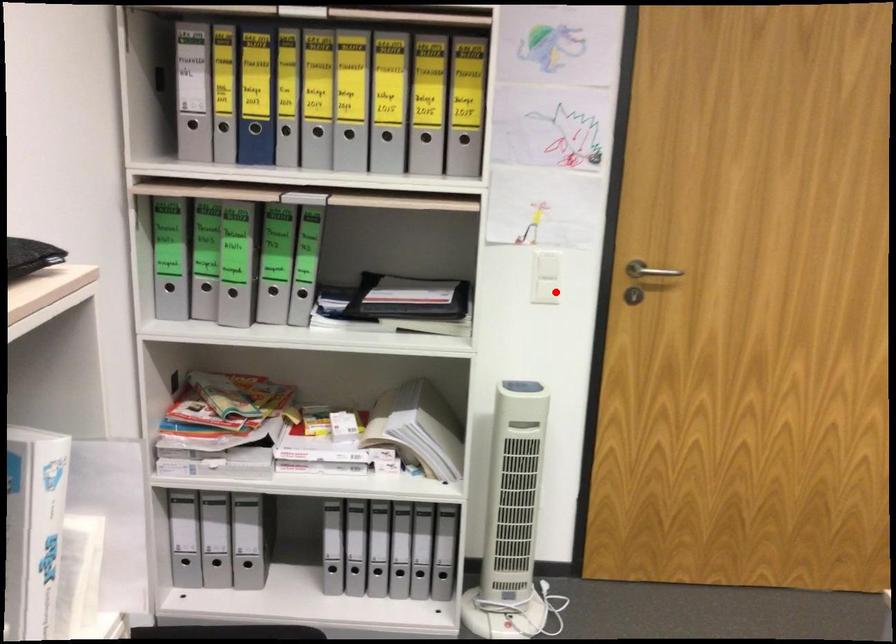
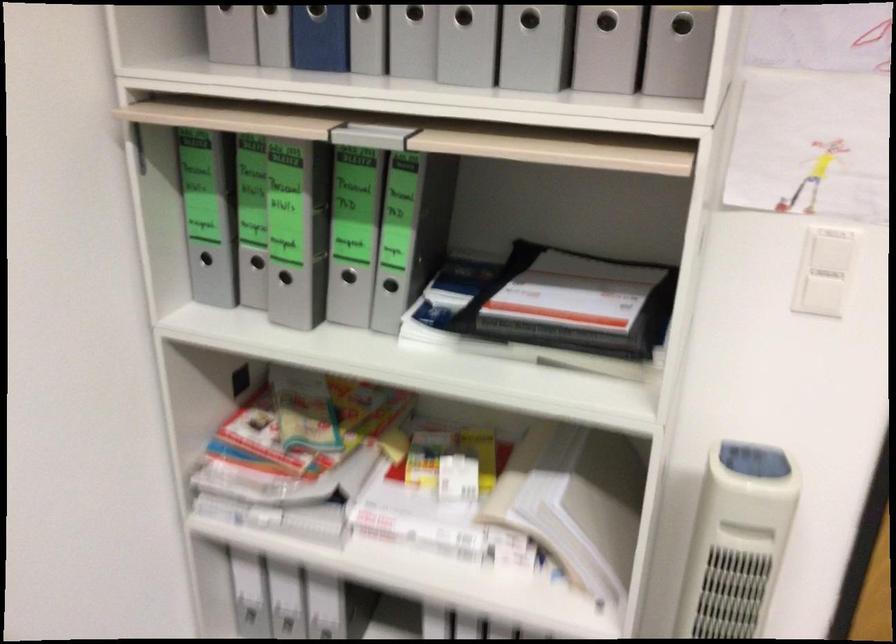
Question: I am providing you with two images of the same scene from different viewpoints. A red point is shown in image1. For the corresponding object point in image2, is it positioned nearer or farther from the camera?

Choices:
 (A) Nearer
 (B) Farther

Answer: (A)